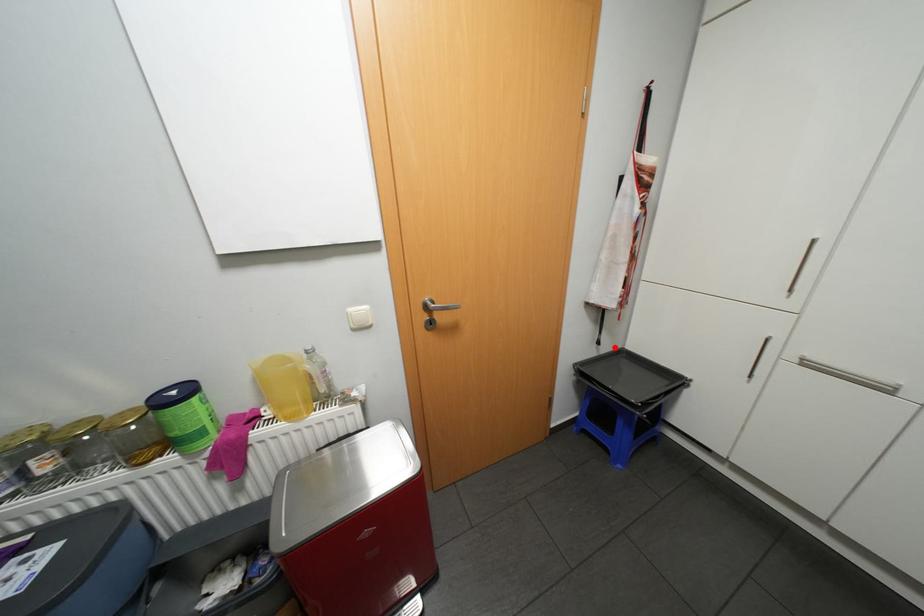
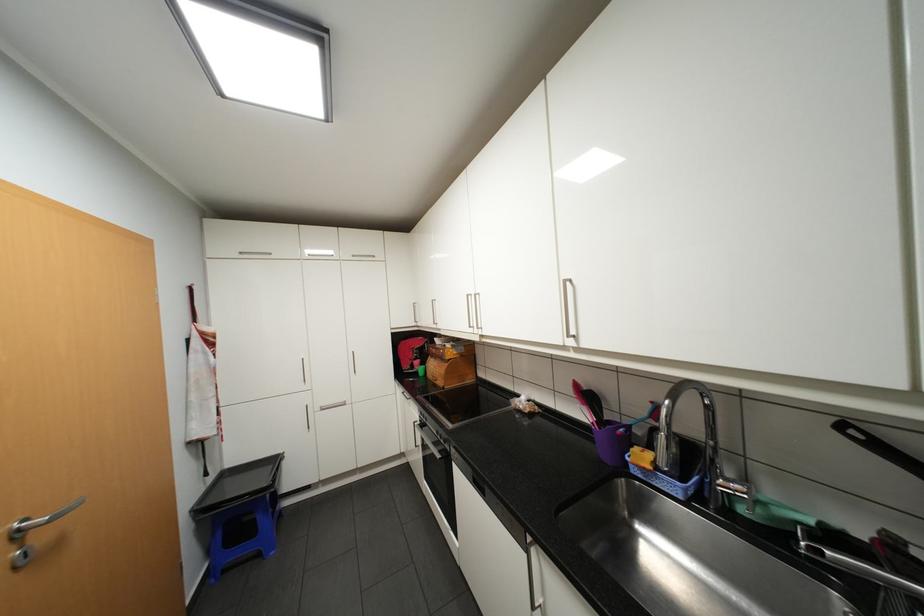
Question: I am providing you with two images of the same scene from different viewpoints. In image1, a red point is highlighted. Considering the same 3D point in image2, which of the following is correct?

Choices:
 (A) It is closer
 (B) It is farther

Answer: (A)